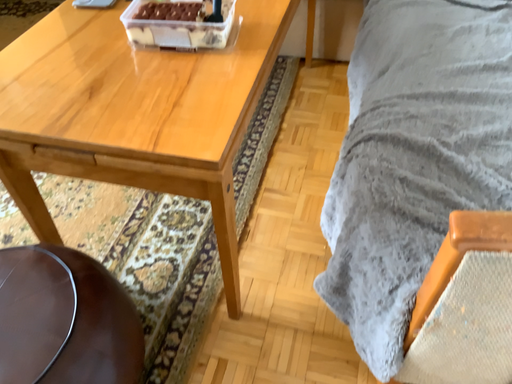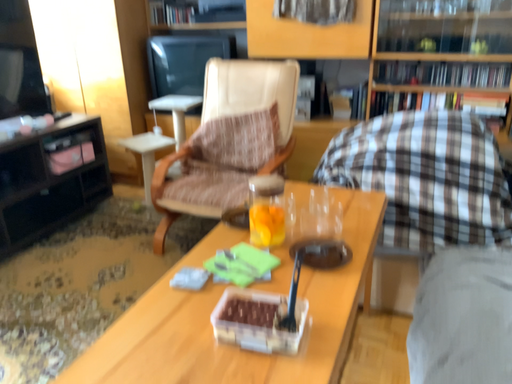
Question: Which way did the camera rotate in the video?

Choices:
 (A) rotated downward
 (B) rotated upward

Answer: (B)